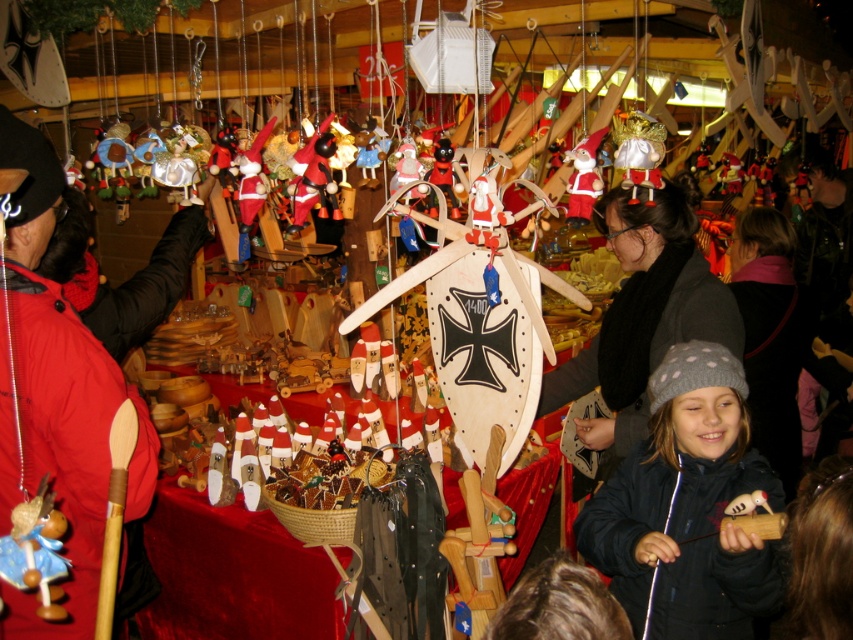
What is located at the point with coordinates (x=688, y=508) in the image?

The gray knitted hat at lower right is located at the point with coordinates (x=688, y=508).

You are standing in front of the table at the Christmas market. There are two points marked on the table surface. One is at coordinate point [666,268] and the other at point [595,196]. Which point is closer to you?

Point [666,268] is further to the camera than point [595,196], so the point closer to you is point [595,196].